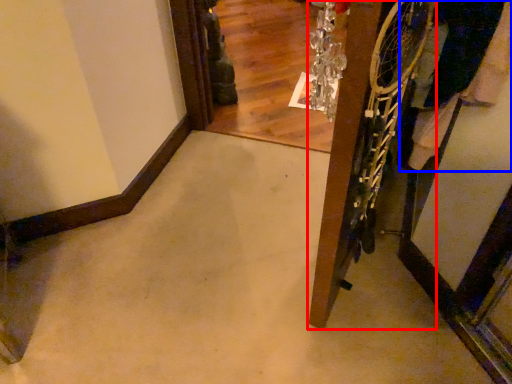
Question: Which of the following is the closest to the observer, door (highlighted by a red box) or clothing (highlighted by a blue box)?

Choices:
 (A) door
 (B) clothing

Answer: (A)